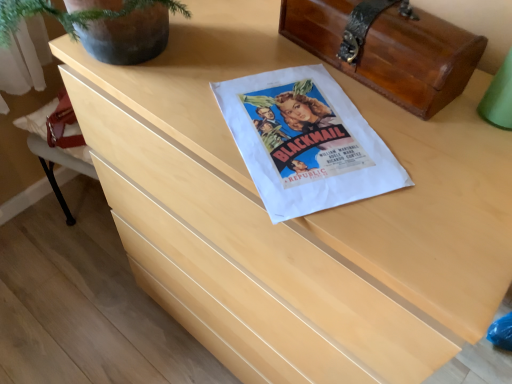
Image resolution: width=512 pixels, height=384 pixels. I want to click on empty space that is in between shiny brown wood chest at upper right and white paper flyer at center, so click(356, 102).